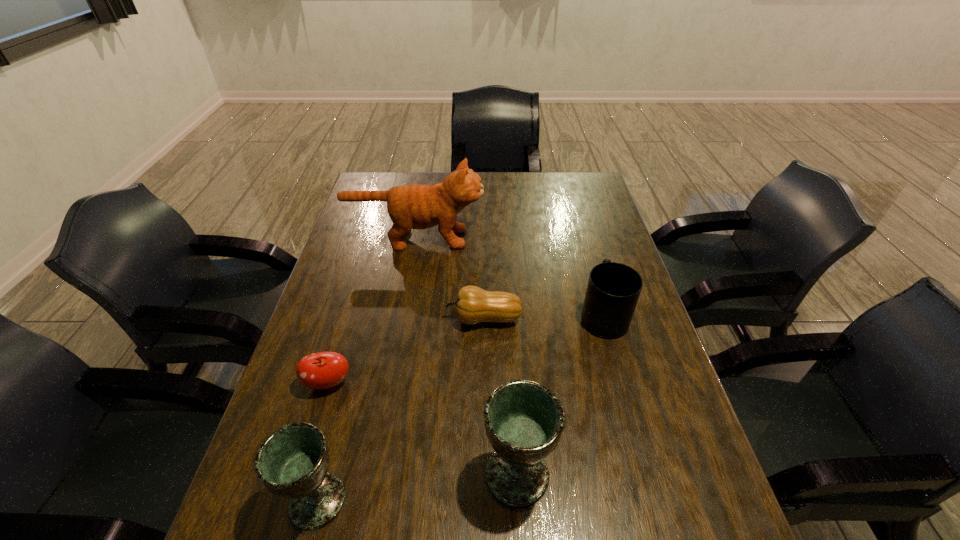
This screenshot has width=960, height=540. Identify the location of chalice that is at the left edge. (292, 462).

I want to click on cat at the left edge, so (415, 206).

Locate an element on the screen. This screenshot has width=960, height=540. apple that is positioned at the left edge is located at coordinates (323, 370).

Locate an element on the screen. The height and width of the screenshot is (540, 960). object that is at the right edge is located at coordinates (613, 290).

Locate an element on the screen. This screenshot has width=960, height=540. object at the near left corner is located at coordinates (292, 462).

Identify the location of vacant space at the far edge of the desktop. The height and width of the screenshot is (540, 960). (548, 186).

I want to click on vacant space at the near edge of the desktop, so point(480,506).

Locate an element on the screen. This screenshot has width=960, height=540. free spot at the left edge of the desktop is located at coordinates (355, 360).

What are the coordinates of `vacant region at the right edge` in the screenshot? It's located at (636, 394).

At what (x,y) coordinates should I click in order to perform the action: click on free location at the far left corner. Please return your answer as a coordinate pair (x, y). This screenshot has height=540, width=960. Looking at the image, I should click on (403, 182).